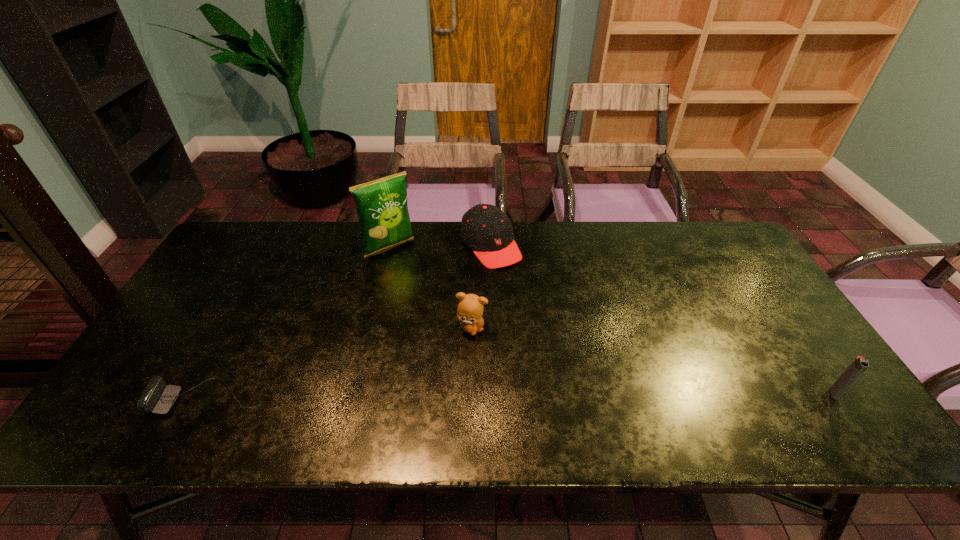
Image resolution: width=960 pixels, height=540 pixels. What are the coordinates of `the shortest object` in the screenshot? It's located at (155, 398).

At what (x,y) coordinates should I click in order to perform the action: click on the leftmost object. Please return your answer as a coordinate pair (x, y). This screenshot has width=960, height=540. Looking at the image, I should click on (155, 398).

The height and width of the screenshot is (540, 960). I want to click on the rightmost object, so click(x=859, y=364).

The height and width of the screenshot is (540, 960). I want to click on the third farthest object, so click(470, 308).

The height and width of the screenshot is (540, 960). What are the coordinates of `cap` in the screenshot? It's located at (485, 229).

The width and height of the screenshot is (960, 540). Identify the location of the tallest object. (382, 208).

I want to click on the second object from left to right, so click(x=382, y=208).

Locate an element on the screen. Image resolution: width=960 pixels, height=540 pixels. vacant region located 0.090m on the front-facing side of the leftmost object is located at coordinates (118, 399).

You are a GUI agent. You are given a task and a screenshot of the screen. Output one action in this format:
    pyautogui.click(x=<x>, y=<y>)
    Task: Click on the blank space located on the front-facing side of the leftmost object
    This screenshot has height=540, width=960.
    Given the screenshot: What is the action you would take?
    pyautogui.click(x=127, y=399)

I want to click on vacant space located on the back of the rightmost object, so click(x=801, y=345).